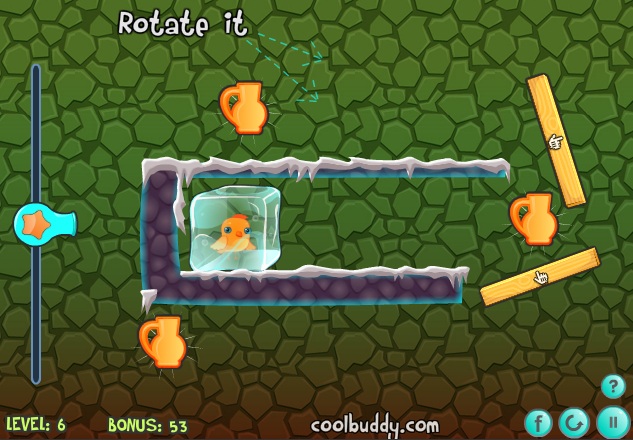
Identify the location of vases. (251, 113), (170, 344), (541, 217).